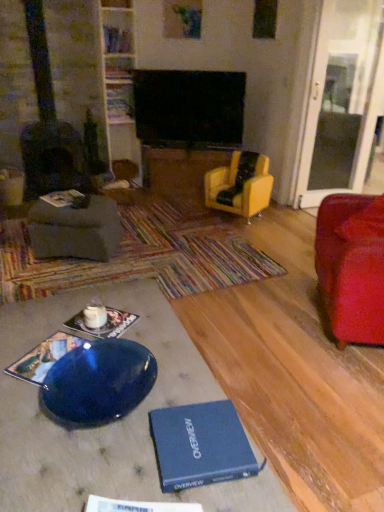
Question: From the image's perspective, is yellow leather armchair at center, acting as the 1th chair starting from the back, beneath matte black book at center, which is counted as the 3th book, starting from the bottom?

Choices:
 (A) no
 (B) yes

Answer: (A)

Question: Can you confirm if yellow leather armchair at center, acting as the 1th chair starting from the back, is positioned to the left of matte black book at center, the third book viewed from the front?

Choices:
 (A) yes
 (B) no

Answer: (B)

Question: Does yellow leather armchair at center, which is the first chair in left-to-right order, have a greater width compared to matte black book at center, which is counted as the 3th book, starting from the bottom?

Choices:
 (A) yes
 (B) no

Answer: (A)

Question: Would you say yellow leather armchair at center, which is the first chair in left-to-right order, contains matte black book at center, the fourth book when ordered from back to front?

Choices:
 (A) yes
 (B) no

Answer: (B)

Question: Is yellow leather armchair at center, marked as the 2th chair in a right-to-left arrangement, further to camera compared to matte black book at center, the fourth book when ordered from top to bottom?

Choices:
 (A) no
 (B) yes

Answer: (B)

Question: From a real-world perspective, does yellow leather armchair at center, marked as the second chair in a front-to-back arrangement, sit lower than matte black book at center, the third book viewed from the front?

Choices:
 (A) yes
 (B) no

Answer: (A)

Question: From a real-world perspective, is blue hardcover book at lower center, placed as the sixth book when sorted from top to bottom, physically below matte gray footrest at left?

Choices:
 (A) no
 (B) yes

Answer: (A)

Question: From a real-world perspective, is blue hardcover book at lower center, which appears as the first book when ordered from the bottom, located higher than matte gray footrest at left?

Choices:
 (A) no
 (B) yes

Answer: (B)

Question: Can you confirm if blue hardcover book at lower center, placed as the sixth book when sorted from top to bottom, is positioned to the left of matte gray footrest at left?

Choices:
 (A) no
 (B) yes

Answer: (A)

Question: Is blue hardcover book at lower center, arranged as the 1th book when viewed from the front, behind matte gray footrest at left?

Choices:
 (A) yes
 (B) no

Answer: (B)

Question: Does blue hardcover book at lower center, which ranks as the 6th book in back-to-front order, have a smaller size compared to matte gray footrest at left?

Choices:
 (A) yes
 (B) no

Answer: (A)

Question: Is blue hardcover book at lower center, placed as the sixth book when sorted from top to bottom, not within matte gray footrest at left?

Choices:
 (A) yes
 (B) no

Answer: (A)

Question: Is glossy blue plate at lower left not within blue hardcover book at lower left, which appears as the fifth book when viewed from the back?

Choices:
 (A) yes
 (B) no

Answer: (A)